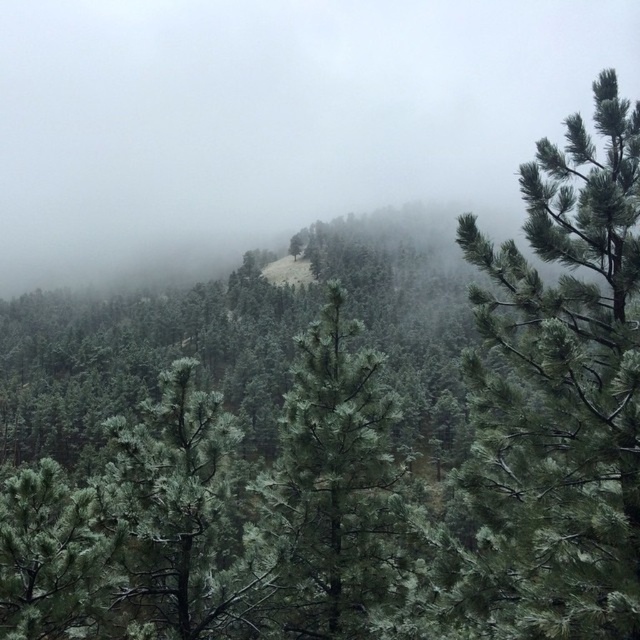
Does green matte pine tree at center have a lesser height compared to green needle-like tree at center?

In fact, green matte pine tree at center may be taller than green needle-like tree at center.

Consider the image. Measure the distance between green matte pine tree at center and green needle-like tree at center.

6.73 meters

This screenshot has height=640, width=640. What do you see at coordinates (563, 388) in the screenshot?
I see `green matte pine tree at center` at bounding box center [563, 388].

I want to click on green matte pine tree at center, so click(x=563, y=388).